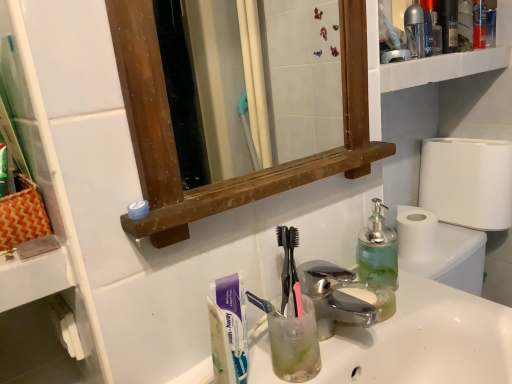
Locate an element on the screen. The height and width of the screenshot is (384, 512). empty space that is to the right of white matte toothpaste at lower left is located at coordinates (333, 353).